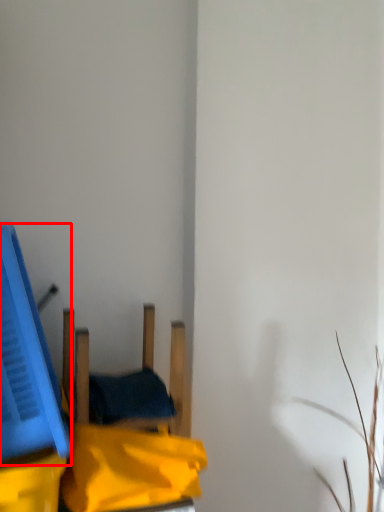
Question: From the image's perspective, considering the relative positions of wide (annotated by the red box) and furniture in the image provided, where is wide (annotated by the red box) located with respect to the staircase?

Choices:
 (A) below
 (B) above

Answer: (B)